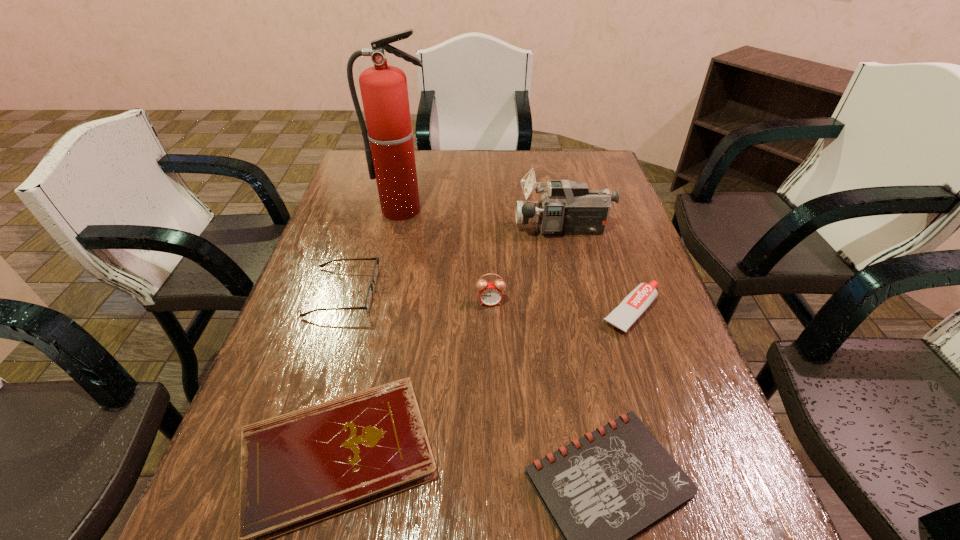
I want to click on vacant region at the far right corner of the desktop, so click(570, 152).

The height and width of the screenshot is (540, 960). What are the coordinates of `vacant region between the second tallest object and the toothpaste` in the screenshot? It's located at (597, 270).

The image size is (960, 540). In order to click on vacant region between the fourth object from left to right and the toothpaste in this screenshot , I will do `click(561, 307)`.

You are a GUI agent. You are given a task and a screenshot of the screen. Output one action in this format:
    pyautogui.click(x=<x>, y=<y>)
    Task: Click on the free area in between the toothpaste and the second tallest object
    This screenshot has height=540, width=960.
    Given the screenshot: What is the action you would take?
    pyautogui.click(x=597, y=270)

I want to click on free area in between the toothpaste and the fire extinguisher, so click(517, 260).

Where is `empty space between the toothpaste and the camcorder`? empty space between the toothpaste and the camcorder is located at coordinates (597, 270).

Select which object appears as the second closest to the taller notebook. Please provide its 2D coordinates. Your answer should be formatted as a tuple, i.e. [(x, y)], where the tuple contains the x and y coordinates of a point satisfying the conditions above.

[(369, 296)]

You are a GUI agent. You are given a task and a screenshot of the screen. Output one action in this format:
    pyautogui.click(x=<x>, y=<y>)
    Task: Click on the object that stands as the sixth closest to the toothpaste
    The width and height of the screenshot is (960, 540).
    Given the screenshot: What is the action you would take?
    pyautogui.click(x=369, y=296)

Identify the location of free spot that satisfies the following two spatial constraints: 1. on the front-facing side of the toothpaste; 2. on the left side of the spectacles. This screenshot has width=960, height=540. (337, 311).

Identify the location of free spot that satisfies the following two spatial constraints: 1. with the nozzle and gauge on the tallest object; 2. on the front-facing side of the spectacles. (385, 292).